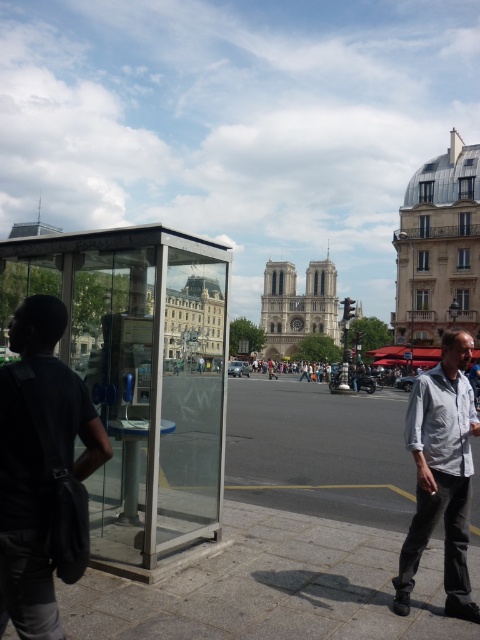
Based on the scene description, where is the dark gray shirt at left located in the image?

The dark gray shirt at left is located at point coordinates of 0.736 on the x axis and 0.090 on the y axis.